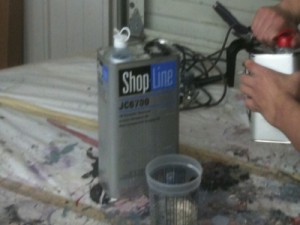
The image size is (300, 225). In order to click on table in this screenshot , I will do `click(218, 129)`.